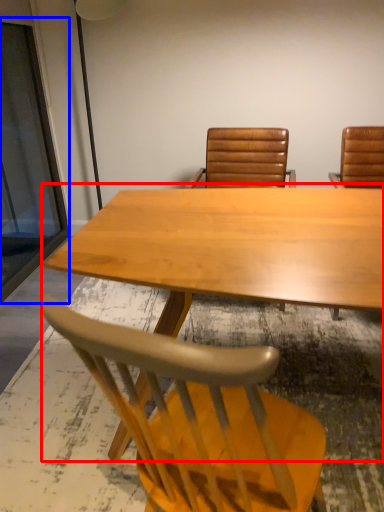
Question: Which object appears farthest to the camera in this image, table (highlighted by a red box) or glass door (highlighted by a blue box)?

Choices:
 (A) table
 (B) glass door

Answer: (B)